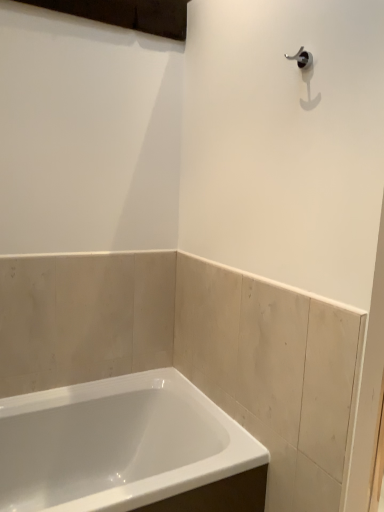
This screenshot has height=512, width=384. Identify the location of white glossy bathtub at lower left. (127, 449).

Describe the element at coordinates (127, 449) in the screenshot. I see `white glossy bathtub at lower left` at that location.

In order to face white glossy bathtub at lower left, should I rotate leftwards or rightwards?

You should rotate left by 10.245 degrees.

The height and width of the screenshot is (512, 384). I want to click on white glossy bathtub at lower left, so click(127, 449).